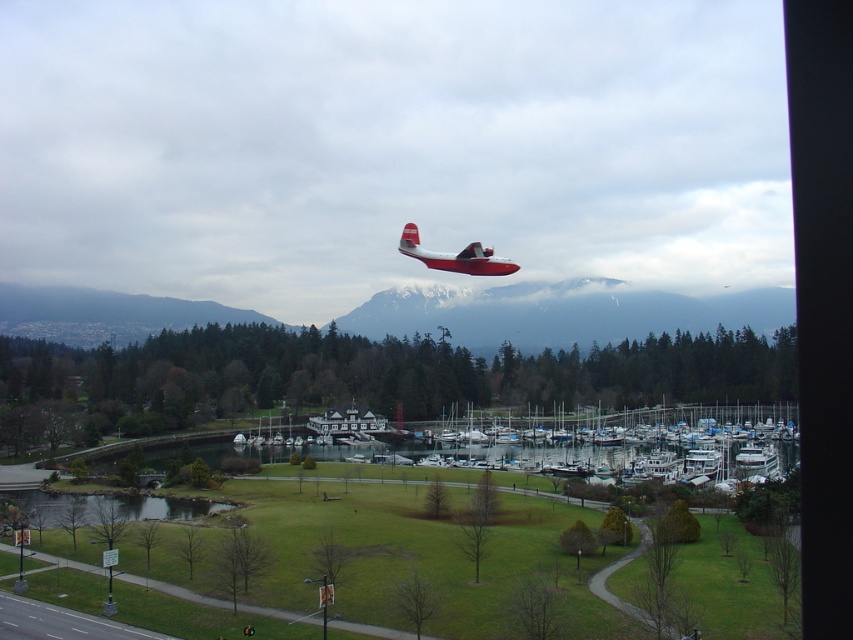
Can you confirm if snowy mountain at center is bigger than red matte seaplane at center?

Correct, snowy mountain at center is larger in size than red matte seaplane at center.

What do you see at coordinates (561, 312) in the screenshot? The image size is (853, 640). I see `snowy mountain at center` at bounding box center [561, 312].

This screenshot has width=853, height=640. What are the coordinates of `snowy mountain at center` in the screenshot? It's located at (561, 312).